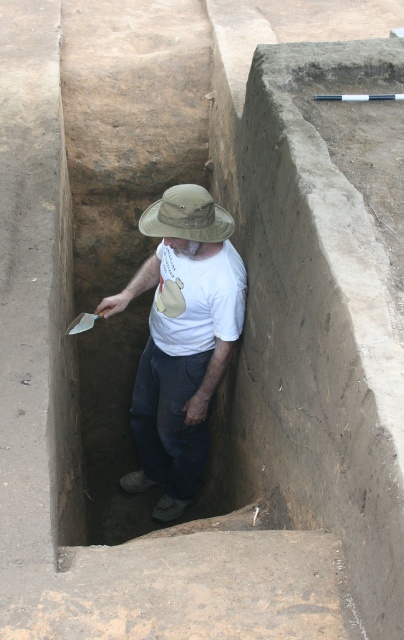
You are standing at the entrance of the trench and see two points marked in the image. Which point, point (153, 465) or point (208, 224), is farther away from you?

Point (153, 465) is behind point (208, 224), so it is farther away from you.